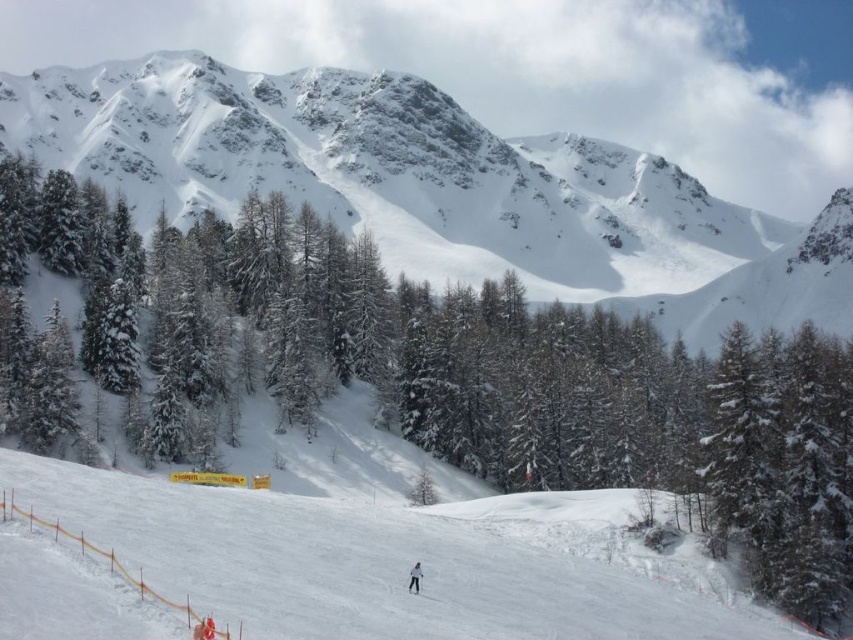
Question: From the image, what is the correct spatial relationship of white snow ski slope at lower center in relation to white snowboarder at center?

Choices:
 (A) left
 (B) right

Answer: (A)

Question: Which point appears farthest from the camera in this image?

Choices:
 (A) (193, 166)
 (B) (416, 564)
 (C) (308, 616)
 (D) (410, 588)

Answer: (A)

Question: Which is farther from the black matte ski at center?

Choices:
 (A) white snowboarder at center
 (B) white snow ski slope at lower center
 (C) snowy granite mountain at upper center

Answer: (C)

Question: Does snowy granite mountain at upper center appear on the left side of black matte ski at center?

Choices:
 (A) no
 (B) yes

Answer: (A)

Question: Which object is closer to the camera taking this photo?

Choices:
 (A) snowy granite mountain at upper center
 (B) white snow ski slope at lower center
 (C) black matte ski at center

Answer: (B)

Question: Does white snow ski slope at lower center come in front of black matte ski at center?

Choices:
 (A) no
 (B) yes

Answer: (B)